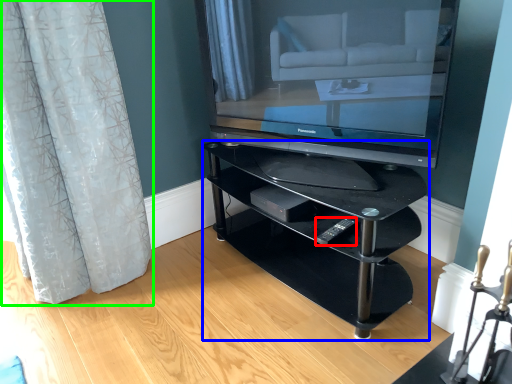
Question: Which is nearer to the remote (highlighted by a red box)? shelf (highlighted by a blue box) or curtain (highlighted by a green box).

Choices:
 (A) shelf
 (B) curtain

Answer: (A)